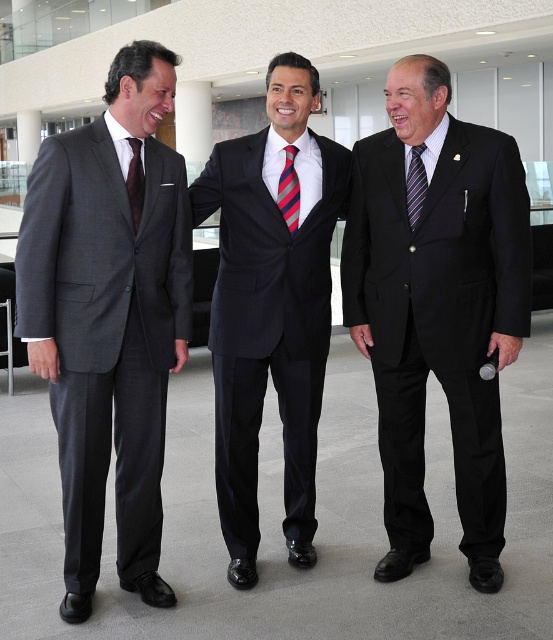
Question: Which point appears farthest from the camera in this image?

Choices:
 (A) (279, 189)
 (B) (155, 502)
 (C) (273, 177)

Answer: (C)

Question: Does matte gray suit at left appear under dark brown silk tie at left?

Choices:
 (A) yes
 (B) no

Answer: (A)

Question: Among these points, which one is farthest from the camera?

Choices:
 (A) (142, 161)
 (B) (227, 296)

Answer: (B)

Question: Among these objects, which one is farthest from the camera?

Choices:
 (A) dark brown silk tie at left
 (B) black suit at center
 (C) striped silk tie at right
 (D) black smooth suit at center

Answer: (C)

Question: Is black smooth suit at center behind striped silk tie at right?

Choices:
 (A) no
 (B) yes

Answer: (A)

Question: Is matte gray suit at left closer to camera compared to dark brown silk tie at left?

Choices:
 (A) no
 (B) yes

Answer: (B)